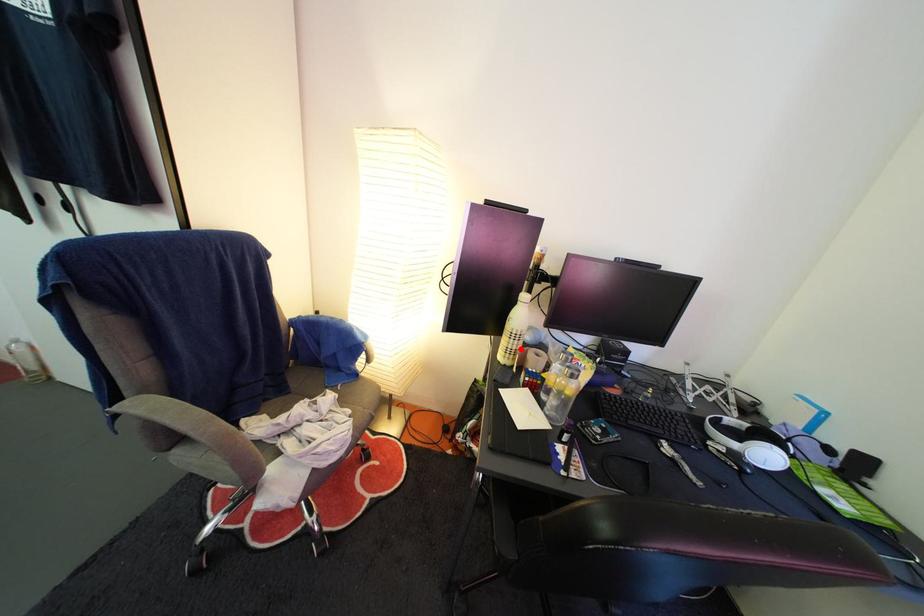
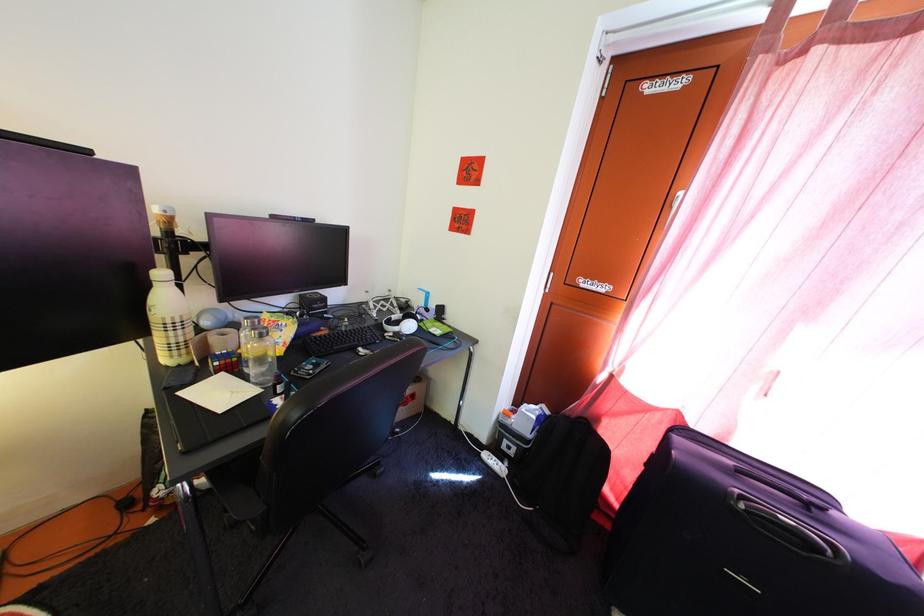
Question: I am providing you with two images of the same scene from different viewpoints. A red point is marked on the first image. At the location where the point appears in image 1, is it still visible in image 2?

Choices:
 (A) Yes
 (B) No

Answer: (A)